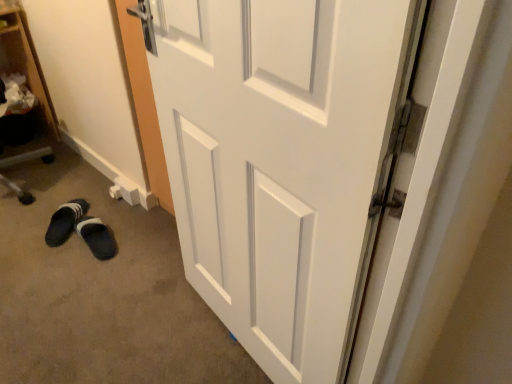
Question: Is black fabric slipper at lower left outside of black suede slipper at lower left?

Choices:
 (A) no
 (B) yes

Answer: (B)

Question: Does black fabric slipper at lower left lie in front of black suede slipper at lower left?

Choices:
 (A) yes
 (B) no

Answer: (B)

Question: From the image's perspective, is black fabric slipper at lower left located beneath black suede slipper at lower left?

Choices:
 (A) no
 (B) yes

Answer: (A)

Question: Does black fabric slipper at lower left have a smaller size compared to black suede slipper at lower left?

Choices:
 (A) yes
 (B) no

Answer: (B)

Question: Is black suede slipper at lower left surrounded by black fabric slipper at lower left?

Choices:
 (A) no
 (B) yes

Answer: (A)

Question: In terms of height, does black suede slipper at lower left look taller or shorter compared to wooden bookshelf at left?

Choices:
 (A) tall
 (B) short

Answer: (B)

Question: From a real-world perspective, is black suede slipper at lower left above or below wooden bookshelf at left?

Choices:
 (A) below
 (B) above

Answer: (A)

Question: Choose the correct answer: Is black suede slipper at lower left inside wooden bookshelf at left or outside it?

Choices:
 (A) outside
 (B) inside

Answer: (A)

Question: Relative to wooden bookshelf at left, is black suede slipper at lower left in front or behind?

Choices:
 (A) front
 (B) behind

Answer: (B)

Question: In terms of size, does white glossy door at center appear bigger or smaller than black suede slipper at lower left?

Choices:
 (A) big
 (B) small

Answer: (A)

Question: Visually, is white glossy door at center positioned to the left or to the right of black suede slipper at lower left?

Choices:
 (A) left
 (B) right

Answer: (B)

Question: From a real-world perspective, is white glossy door at center physically located above or below black suede slipper at lower left?

Choices:
 (A) below
 (B) above

Answer: (B)

Question: In the image, is white glossy door at center positioned in front of or behind black suede slipper at lower left?

Choices:
 (A) behind
 (B) front

Answer: (B)

Question: From a real-world perspective, is black fabric slipper at lower left physically located above or below white glossy door at center?

Choices:
 (A) above
 (B) below

Answer: (B)

Question: Is point (53, 228) positioned closer to the camera than point (353, 304)?

Choices:
 (A) closer
 (B) farther

Answer: (B)